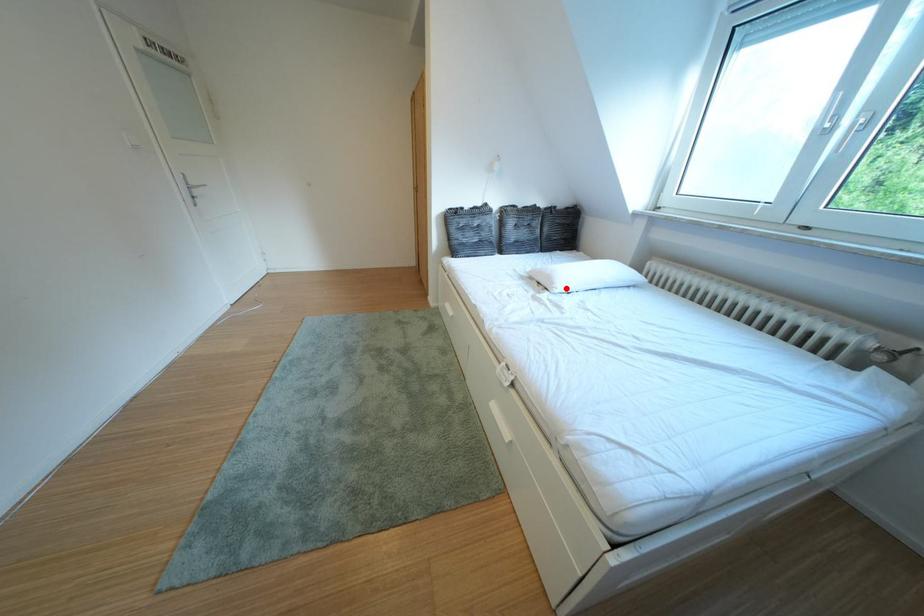
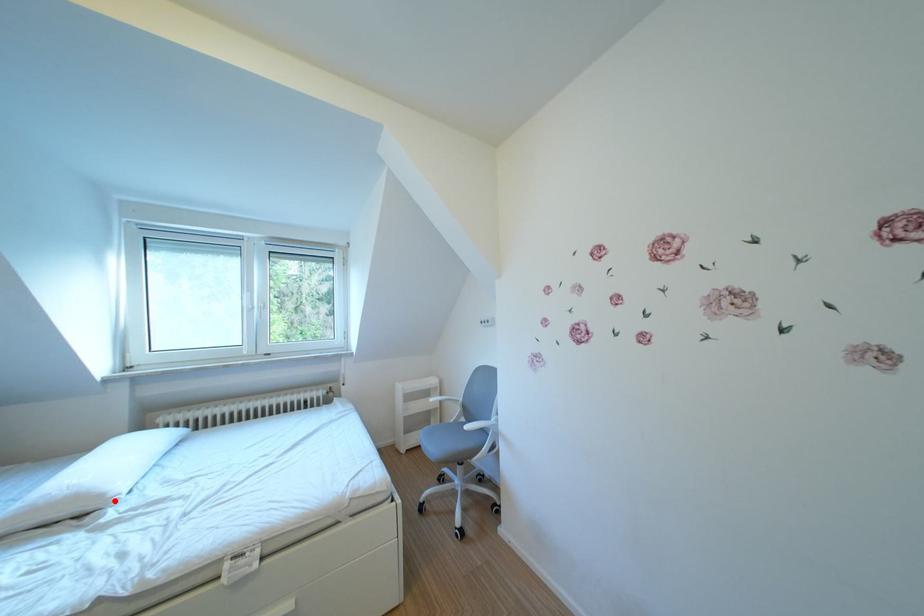
I am providing you with two images of the same scene from different viewpoints. A red point is marked on the first image and another point is marked on the second image. Do the highlighted points in image1 and image2 indicate the same real-world spot?

Yes